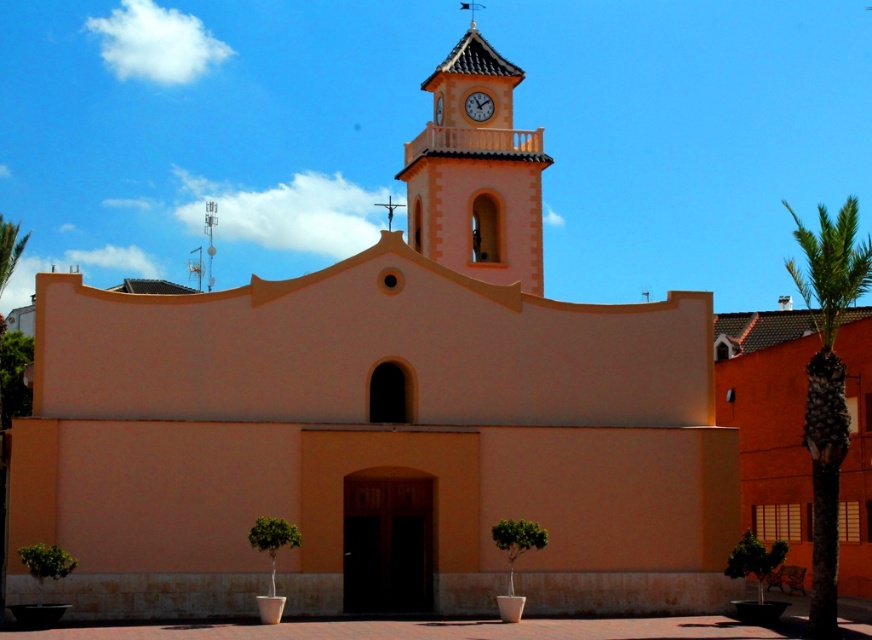
What do you see at coordinates (9, 250) in the screenshot?
I see `green leafy palm tree at left` at bounding box center [9, 250].

Can you confirm if green leafy palm tree at left is smaller than white plastic clock at upper center?

No, green leafy palm tree at left is not smaller than white plastic clock at upper center.

Is point (16, 252) farther from camera compared to point (481, 106)?

No, (16, 252) is closer to viewer.

This screenshot has height=640, width=872. Find the location of `green leafy palm tree at left`. green leafy palm tree at left is located at coordinates (9, 250).

Is metallic spire at upper center to the left of white plastic clock at upper center from the viewer's perspective?

Correct, you'll find metallic spire at upper center to the left of white plastic clock at upper center.

Which of these two, metallic spire at upper center or white plastic clock at upper center, stands shorter?

Standing shorter between the two is white plastic clock at upper center.

Who is more distant from viewer, (212, 241) or (489, 113)?

Point (212, 241)

In order to click on metallic spire at upper center in this screenshot , I will do pos(209,237).

Can you confirm if green leafy palm tree at right is positioned to the left of metallic spire at upper center?

In fact, green leafy palm tree at right is to the right of metallic spire at upper center.

Which is below, green leafy palm tree at right or metallic spire at upper center?

green leafy palm tree at right is below.

Does point (838, 381) come closer to viewer compared to point (208, 218)?

That is True.

At what (x,y) coordinates should I click in order to perform the action: click on green leafy palm tree at right. Please return your answer as a coordinate pair (x, y). Looking at the image, I should click on (828, 385).